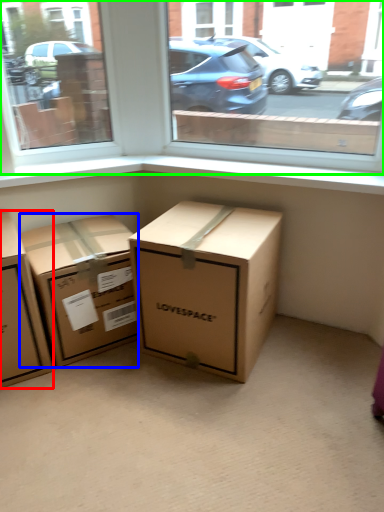
Question: Which is nearer to the box (highlighted by a red box)? box (highlighted by a blue box) or window (highlighted by a green box).

Choices:
 (A) box
 (B) window

Answer: (A)